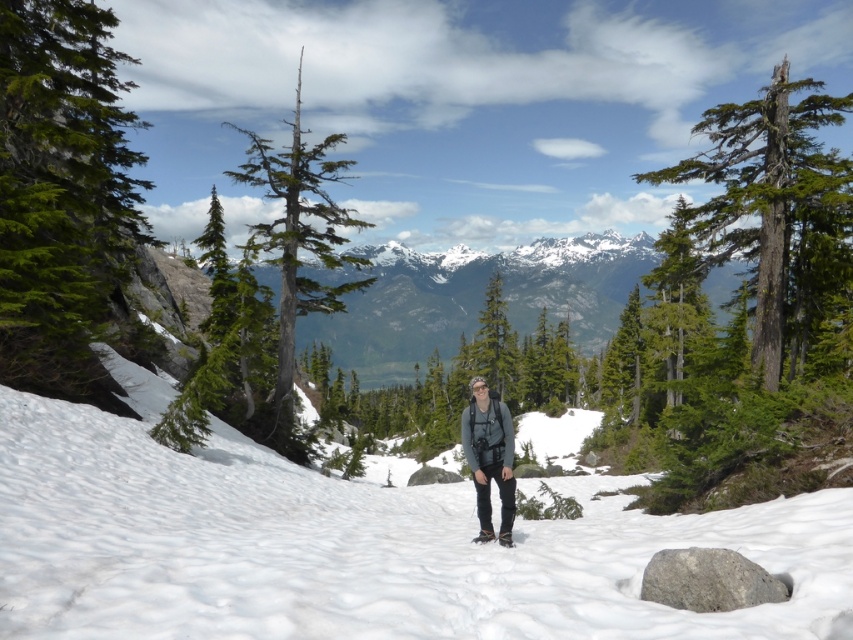
Question: Does white fluffy snow at center have a smaller size compared to green coniferous tree at left?

Choices:
 (A) yes
 (B) no

Answer: (A)

Question: Among these points, which one is nearest to the camera?

Choices:
 (A) (103, 262)
 (B) (288, 419)
 (C) (646, 401)

Answer: (A)

Question: Does white fluffy snow at center lie in front of gray bark tree at center?

Choices:
 (A) no
 (B) yes

Answer: (B)

Question: From the image, what is the correct spatial relationship of green rough bark tree at upper right in relation to green textured tree at upper right?

Choices:
 (A) right
 (B) left

Answer: (A)

Question: Which object appears farthest from the camera in this image?

Choices:
 (A) green rough bark tree at upper right
 (B) green textured tree at upper right
 (C) gray bark tree at center
 (D) gray fabric jacket at center

Answer: (C)

Question: Which point is closer to the camera taking this photo?

Choices:
 (A) (334, 262)
 (B) (648, 352)
 (C) (102, 144)

Answer: (C)